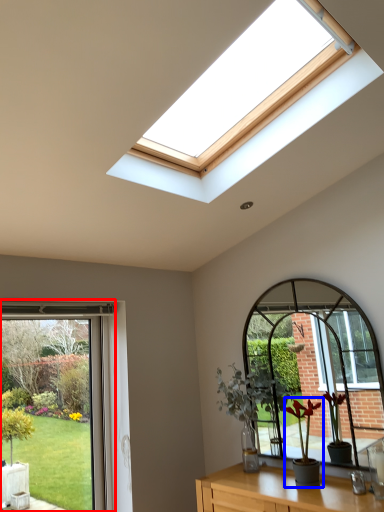
Question: Which object appears closest to the camera in this image, window (highlighted by a red box) or houseplant (highlighted by a blue box)?

Choices:
 (A) window
 (B) houseplant

Answer: (B)